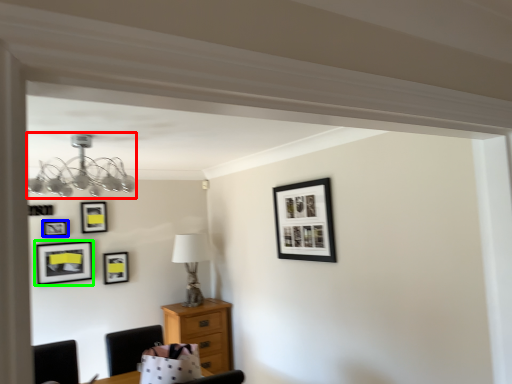
Question: Based on their relative distances, which object is farther from lamp (highlighted by a red box)? Choose from picture frame (highlighted by a blue box) and picture frame (highlighted by a green box).

Choices:
 (A) picture frame
 (B) picture frame

Answer: (A)